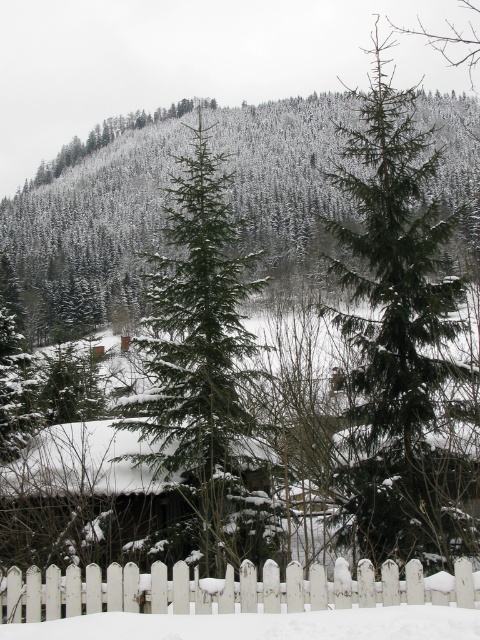
Question: Estimate the real-world distances between objects in this image. Which object is farther from the white wooden picket fence at lower center?

Choices:
 (A) green matte evergreen tree at center
 (B) snow-covered evergreen trees at upper center
 (C) green needle-like tree at center

Answer: (B)

Question: Does snow-covered evergreen trees at upper center appear on the right side of white wooden picket fence at lower center?

Choices:
 (A) yes
 (B) no

Answer: (B)

Question: Which of the following is the closest to the observer?

Choices:
 (A) green needle-like tree at center
 (B) green matte evergreen tree at center
 (C) white wooden picket fence at lower center
 (D) snow-covered evergreen trees at upper center

Answer: (C)

Question: Which of the following is the closest to the observer?

Choices:
 (A) (420, 218)
 (B) (96, 600)

Answer: (B)

Question: Is snow-covered evergreen trees at upper center thinner than white wooden picket fence at lower center?

Choices:
 (A) yes
 (B) no

Answer: (B)

Question: Considering the relative positions of green matte evergreen tree at center and white wooden picket fence at lower center in the image provided, where is green matte evergreen tree at center located with respect to white wooden picket fence at lower center?

Choices:
 (A) above
 (B) below

Answer: (A)